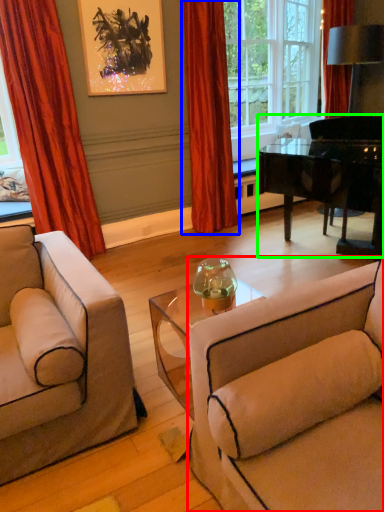
Question: Which object is the farthest from studio couch (highlighted by a red box)? Choose among these: curtain (highlighted by a blue box) or piano (highlighted by a green box).

Choices:
 (A) curtain
 (B) piano

Answer: (A)